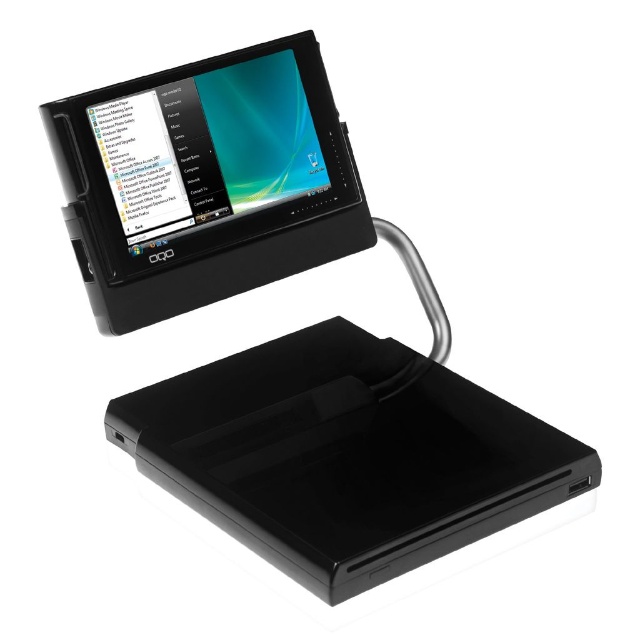
Between black glossy ipod at lower center and matte black tablet at upper left, which one has less height?

With less height is black glossy ipod at lower center.

Who is more distant from viewer, (x=337, y=480) or (x=118, y=115)?

The point (x=118, y=115) is behind.

Does point (204, 428) come in front of point (129, 154)?

No.

Identify the location of black glossy ipod at lower center. The width and height of the screenshot is (640, 640). (346, 454).